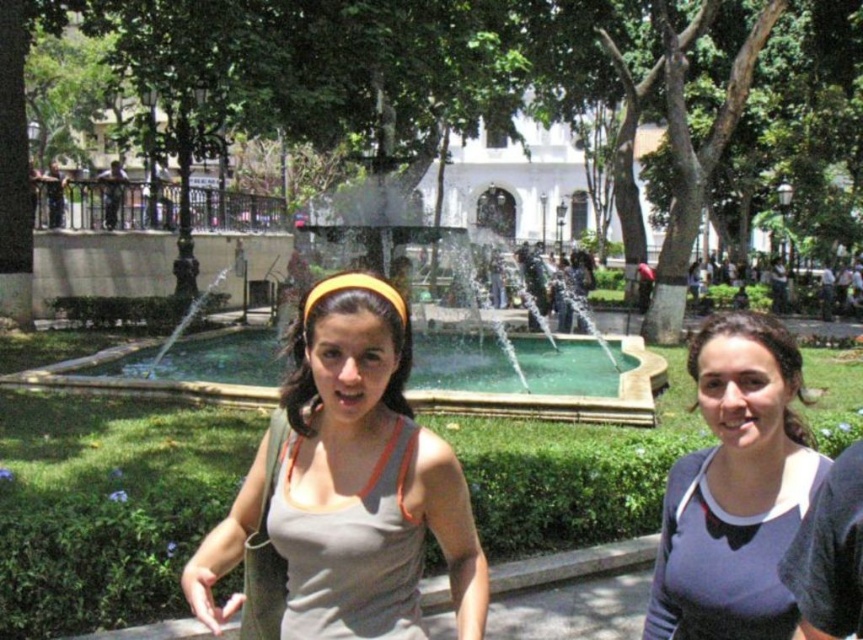
Image resolution: width=863 pixels, height=640 pixels. In order to click on matte gray tank top at center in this screenshot , I will do tap(364, 476).

Is matte gray tank top at center wider than green stone fountain at center?

No.

This screenshot has width=863, height=640. What do you see at coordinates (364, 476) in the screenshot?
I see `matte gray tank top at center` at bounding box center [364, 476].

The image size is (863, 640). What are the coordinates of `matte gray tank top at center` in the screenshot? It's located at (364, 476).

Does matte gray tank top at center have a lesser height compared to gray matte tank top at center?

Correct, matte gray tank top at center is not as tall as gray matte tank top at center.

Is matte gray tank top at center thinner than gray matte tank top at center?

Yes, matte gray tank top at center is thinner than gray matte tank top at center.

Find the location of a particular element. The width and height of the screenshot is (863, 640). matte gray tank top at center is located at coordinates (364, 476).

Is gray matte tank top at center in front of green stone fountain at center?

That is True.

Is gray matte tank top at center shorter than green stone fountain at center?

Yes, gray matte tank top at center is shorter than green stone fountain at center.

What do you see at coordinates (735, 488) in the screenshot? I see `gray matte tank top at center` at bounding box center [735, 488].

Find the location of `gray matte tank top at center`. gray matte tank top at center is located at coordinates (735, 488).